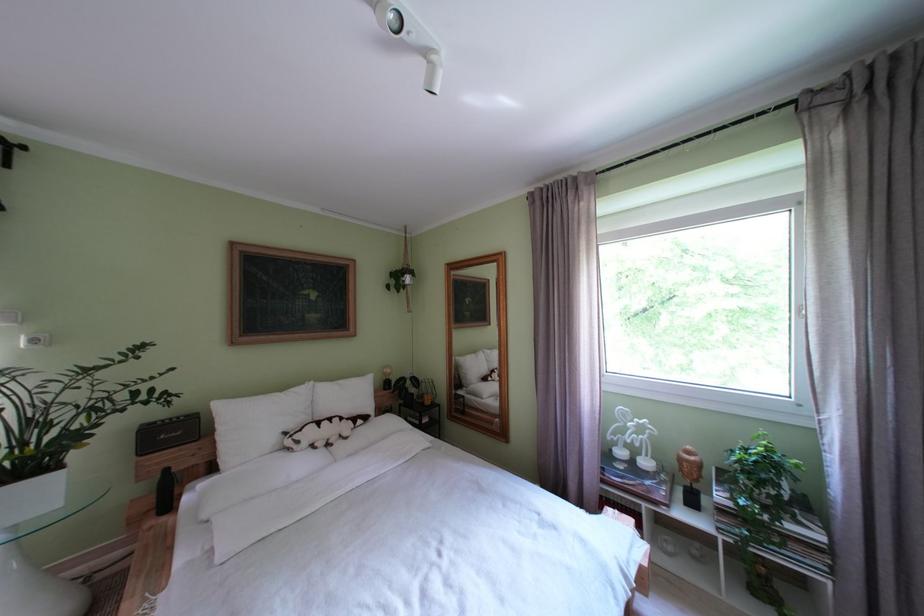
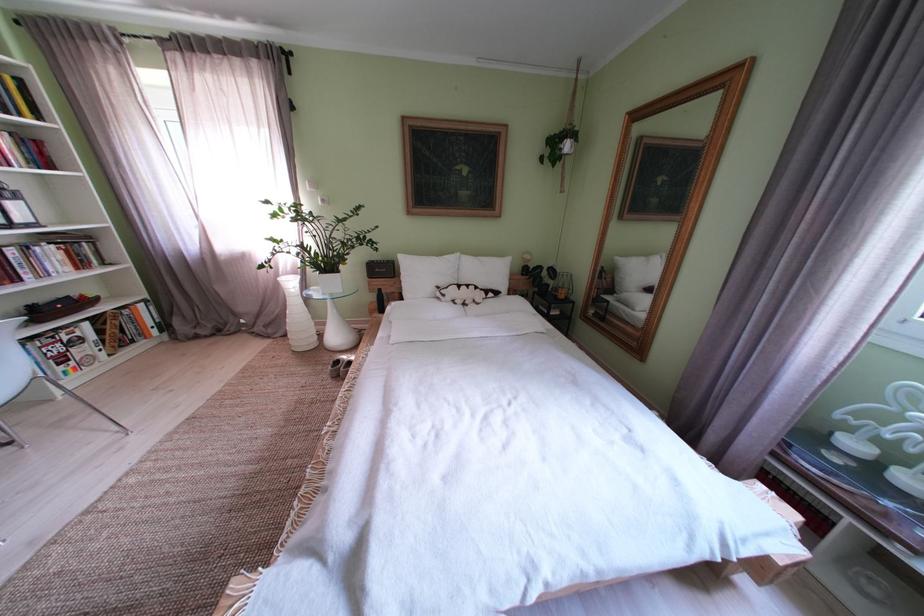
Where in the second image is the point corresponding to point 310,447 from the first image?

(455, 301)